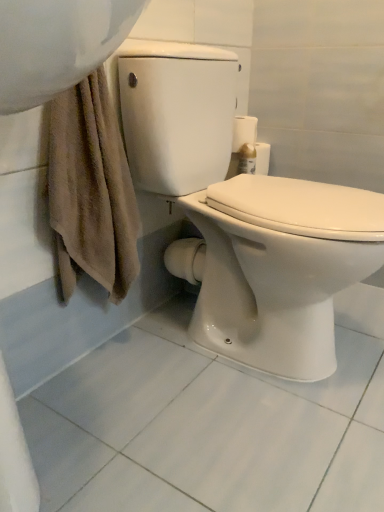
Describe the element at coordinates (248, 143) in the screenshot. I see `white glossy toilet paper at upper right` at that location.

In order to face white glossy toilet paper at upper right, should I rotate leftwards or rightwards?

To face it directly, rotate right by 8.182 degrees.

Locate an element on the screen. This screenshot has width=384, height=512. white glossy toilet paper at upper right is located at coordinates (248, 143).

Measure the distance between point (235, 157) and camera.

The distance of point (235, 157) from camera is 1.20 meters.

Where is `white glossy toilet at center`? white glossy toilet at center is located at coordinates (243, 217).

This screenshot has height=512, width=384. What do you see at coordinates (243, 217) in the screenshot?
I see `white glossy toilet at center` at bounding box center [243, 217].

This screenshot has height=512, width=384. I want to click on white glossy toilet paper at upper right, so click(248, 143).

Can you confirm if white glossy toilet at center is positioned to the left of white glossy toilet paper at upper right?

Correct, you'll find white glossy toilet at center to the left of white glossy toilet paper at upper right.

In the image, is white glossy toilet at center positioned in front of or behind white glossy toilet paper at upper right?

Clearly, white glossy toilet at center is in front of white glossy toilet paper at upper right.

Considering the positions of point (180, 130) and point (251, 138), is point (180, 130) closer or farther from the camera than point (251, 138)?

Clearly, point (180, 130) is closer to the camera than point (251, 138).

From the image's perspective, is white glossy toilet at center on top of white glossy toilet paper at upper right?

No, from the image's perspective, white glossy toilet at center is not on top of white glossy toilet paper at upper right.

From a real-world perspective, is white glossy toilet at center beneath white glossy toilet paper at upper right?

Indeed, from a real-world perspective, white glossy toilet at center is positioned beneath white glossy toilet paper at upper right.

Considering the relative sizes of white glossy toilet at center and white glossy toilet paper at upper right in the image provided, is white glossy toilet at center thinner than white glossy toilet paper at upper right?

No, white glossy toilet at center is not thinner than white glossy toilet paper at upper right.

From their relative heights in the image, would you say white glossy toilet at center is taller or shorter than white glossy toilet paper at upper right?

Clearly, white glossy toilet at center is taller compared to white glossy toilet paper at upper right.

From the picture: Looking at the image, does white glossy toilet at center seem bigger or smaller compared to white glossy toilet paper at upper right?

In the image, white glossy toilet at center appears to be larger than white glossy toilet paper at upper right.

Is white glossy toilet at center surrounding white glossy toilet paper at upper right?

No, white glossy toilet paper at upper right is not inside white glossy toilet at center.

Are white glossy toilet at center and white glossy toilet paper at upper right located far from each other?

Actually, white glossy toilet at center and white glossy toilet paper at upper right are a little close together.

Is white glossy toilet at center oriented away from white glossy toilet paper at upper right?

white glossy toilet at center is not turned away from white glossy toilet paper at upper right.

How different are the orientations of white glossy toilet at center and white glossy toilet paper at upper right in degrees?

The angle between the facing direction of white glossy toilet at center and the facing direction of white glossy toilet paper at upper right is 0.63 degrees.

Find the location of `toilet paper that appears above the white glossy toilet at center (from the image's perspective)`. toilet paper that appears above the white glossy toilet at center (from the image's perspective) is located at coordinates (248, 143).

Visually, is white glossy toilet paper at upper right positioned to the left or to the right of white glossy toilet at center?

white glossy toilet paper at upper right is to the right of white glossy toilet at center.

Is the depth of white glossy toilet paper at upper right less than that of white glossy toilet at center?

No.

Is point (251, 143) closer to viewer compared to point (192, 177)?

No, (251, 143) is further to viewer.

From the image's perspective, is white glossy toilet paper at upper right located beneath white glossy toilet at center?

No.

From a real-world perspective, is white glossy toilet paper at upper right over white glossy toilet at center?

Indeed, from a real-world perspective, white glossy toilet paper at upper right stands above white glossy toilet at center.

Which of these two, white glossy toilet paper at upper right or white glossy toilet at center, is wider?

white glossy toilet at center is wider.

Between white glossy toilet paper at upper right and white glossy toilet at center, which one has more height?

white glossy toilet at center is taller.

From the picture: Is white glossy toilet paper at upper right smaller than white glossy toilet at center?

Correct, white glossy toilet paper at upper right occupies less space than white glossy toilet at center.

Choose the correct answer: Is white glossy toilet paper at upper right inside white glossy toilet at center or outside it?

white glossy toilet paper at upper right is not enclosed by white glossy toilet at center.

Is white glossy toilet paper at upper right not near white glossy toilet at center?

No.

Is white glossy toilet paper at upper right looking in the opposite direction of white glossy toilet at center?

white glossy toilet paper at upper right is not turned away from white glossy toilet at center.

Locate an element on the screen. toilet paper above the white glossy toilet at center (from the image's perspective) is located at coordinates (248, 143).

Identify the location of toilet paper on the right of white glossy toilet at center. This screenshot has width=384, height=512. (x=248, y=143).

The width and height of the screenshot is (384, 512). What are the coordinates of `toilet in front of the white glossy toilet paper at upper right` in the screenshot? It's located at (243, 217).